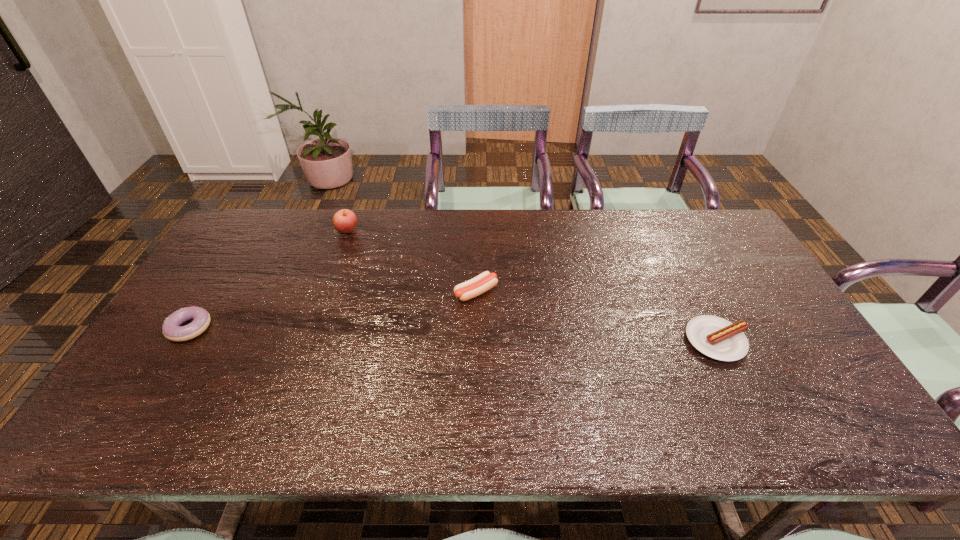
Where is `blank region between the doughnut and the nearer sausage`? The width and height of the screenshot is (960, 540). blank region between the doughnut and the nearer sausage is located at coordinates (453, 334).

Locate an element on the screen. The height and width of the screenshot is (540, 960). vacant area that lies between the left sausage and the third object from right to left is located at coordinates (412, 261).

Locate an element on the screen. vacant area that lies between the apple and the leftmost object is located at coordinates (269, 279).

Locate an element on the screen. This screenshot has width=960, height=540. empty space that is in between the tallest object and the leftmost object is located at coordinates (269, 279).

The width and height of the screenshot is (960, 540). What are the coordinates of `free space between the doughnut and the tallest object` in the screenshot? It's located at (269, 279).

At what (x,y) coordinates should I click in order to perform the action: click on empty space that is in between the nearer sausage and the leftmost object. Please return your answer as a coordinate pair (x, y). This screenshot has width=960, height=540. Looking at the image, I should click on (453, 334).

Identify the location of free space that is in between the nearer sausage and the doughnut. This screenshot has width=960, height=540. (453, 334).

Find the location of a particular element. empty space that is in between the leftmost object and the right sausage is located at coordinates (453, 334).

Locate an element on the screen. This screenshot has width=960, height=540. vacant region between the leftmost object and the left sausage is located at coordinates (333, 310).

Where is `free space between the third object from right to left and the leftmost object`? The height and width of the screenshot is (540, 960). free space between the third object from right to left and the leftmost object is located at coordinates (269, 279).